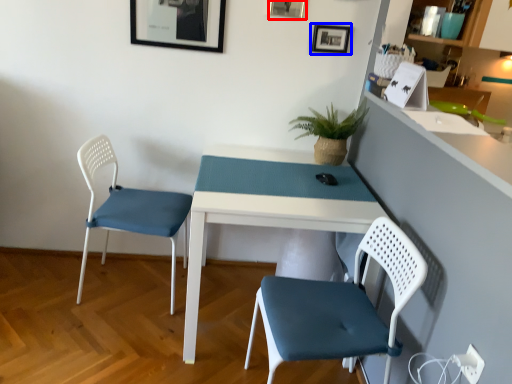
Question: Among these objects, which one is farthest to the camera, picture frame (highlighted by a red box) or picture frame (highlighted by a blue box)?

Choices:
 (A) picture frame
 (B) picture frame

Answer: (B)